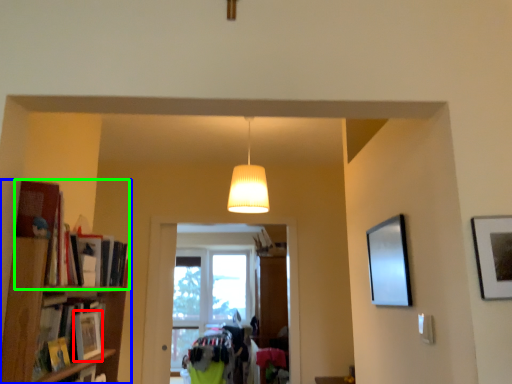
Question: Which object is positioned farthest from book (highlighted by a red box)? Select from shelf (highlighted by a blue box) and book (highlighted by a green box).

Choices:
 (A) shelf
 (B) book

Answer: (B)